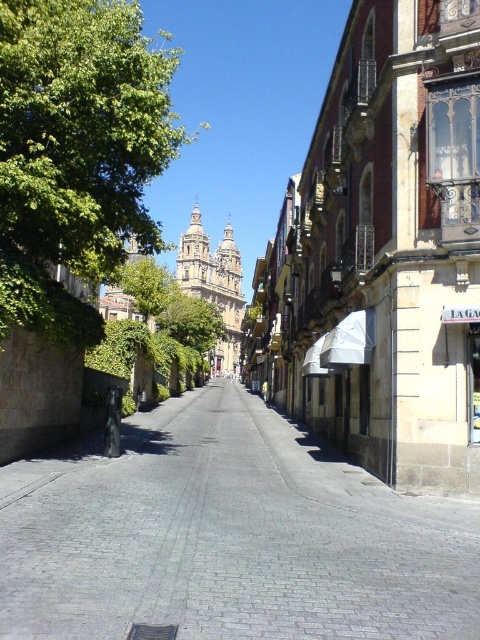
Consider the image. You are standing on a cobblestone street in a European city. You notice a point marked at coordinates (x=228, y=536). What is located at that point?

At point (x=228, y=536) lies gray cobblestone pavement at center.